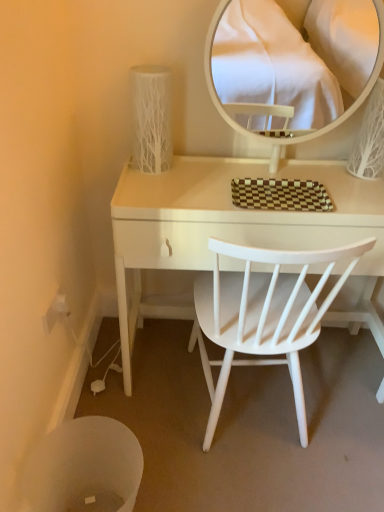
Question: Are white glossy mirror at upper center and white plastic power outlet at lower left making contact?

Choices:
 (A) no
 (B) yes

Answer: (A)

Question: Does white glossy mirror at upper center have a greater height compared to white plastic power outlet at lower left?

Choices:
 (A) no
 (B) yes

Answer: (B)

Question: Does white glossy mirror at upper center contain white plastic power outlet at lower left?

Choices:
 (A) yes
 (B) no

Answer: (B)

Question: Considering the relative sizes of white glossy mirror at upper center and white plastic power outlet at lower left in the image provided, is white glossy mirror at upper center thinner than white plastic power outlet at lower left?

Choices:
 (A) yes
 (B) no

Answer: (B)

Question: Could you tell me if white glossy mirror at upper center is facing white plastic power outlet at lower left?

Choices:
 (A) no
 (B) yes

Answer: (A)

Question: Is white wood desk at center wider or thinner than white plastic power outlet at lower left?

Choices:
 (A) thin
 (B) wide

Answer: (B)

Question: Is white wood desk at center inside or outside of white plastic power outlet at lower left?

Choices:
 (A) outside
 (B) inside

Answer: (A)

Question: From the image's perspective, is white wood desk at center above or below white plastic power outlet at lower left?

Choices:
 (A) below
 (B) above

Answer: (B)

Question: Considering the positions of white wood desk at center and white plastic power outlet at lower left in the image, is white wood desk at center taller or shorter than white plastic power outlet at lower left?

Choices:
 (A) tall
 (B) short

Answer: (A)

Question: Considering the positions of white plastic power outlet at lower left and white glossy mirror at upper center in the image, is white plastic power outlet at lower left wider or thinner than white glossy mirror at upper center?

Choices:
 (A) wide
 (B) thin

Answer: (B)

Question: Is point (48, 308) positioned closer to the camera than point (288, 82)?

Choices:
 (A) farther
 (B) closer

Answer: (B)

Question: In terms of height, does white plastic power outlet at lower left look taller or shorter compared to white glossy mirror at upper center?

Choices:
 (A) tall
 (B) short

Answer: (B)

Question: Is white plastic power outlet at lower left inside the boundaries of white glossy mirror at upper center, or outside?

Choices:
 (A) inside
 (B) outside

Answer: (B)

Question: Is white plastic trash bin at lower left inside the boundaries of white wood desk at center, or outside?

Choices:
 (A) inside
 (B) outside

Answer: (B)

Question: In the image, is white plastic trash bin at lower left on the left side or the right side of white wood desk at center?

Choices:
 (A) left
 (B) right

Answer: (A)